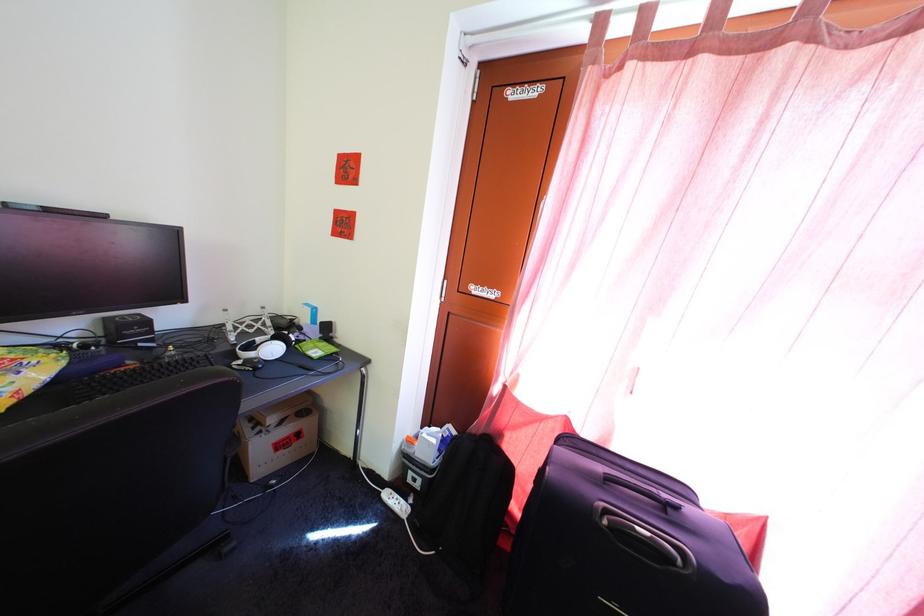
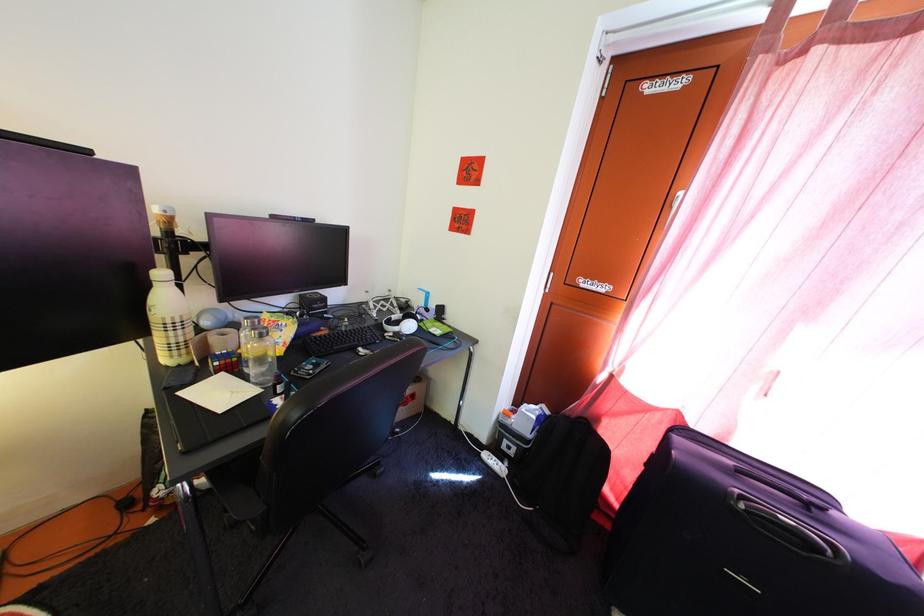
Where in the second image is the point corresponding to point (614, 531) from the first image?

(751, 515)